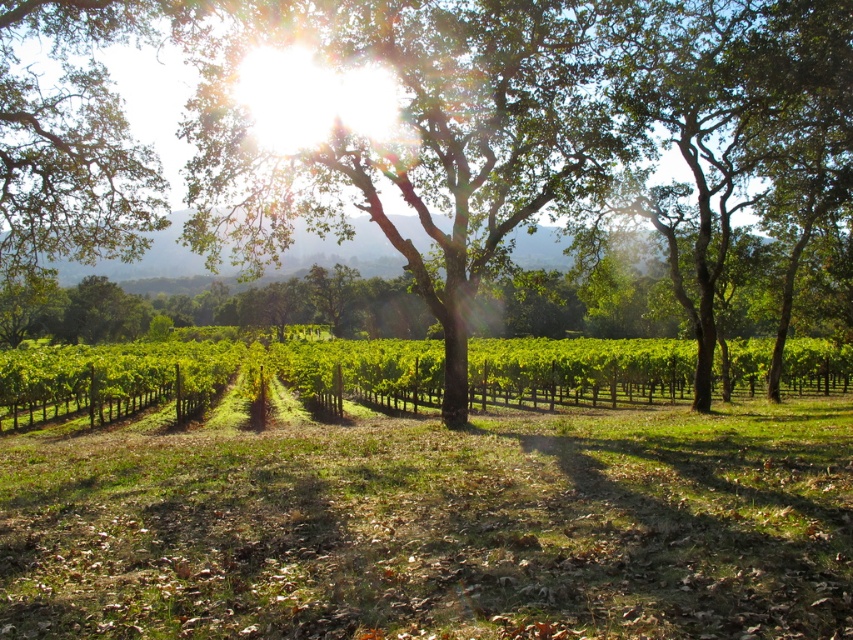
Is green leafy tree at center positioned before green leafy vines at center?

Yes, green leafy tree at center is closer to the viewer.

Who is lower down, green leafy tree at center or green leafy vines at center?

Positioned lower is green leafy vines at center.

What do you see at coordinates (509, 125) in the screenshot? I see `green leafy tree at center` at bounding box center [509, 125].

Image resolution: width=853 pixels, height=640 pixels. What are the coordinates of `green leafy tree at center` in the screenshot? It's located at (509, 125).